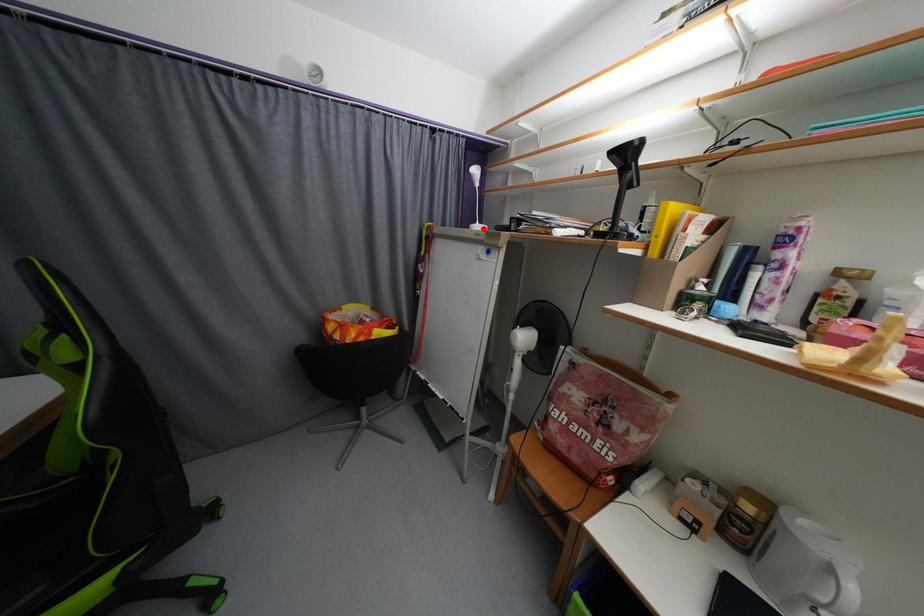
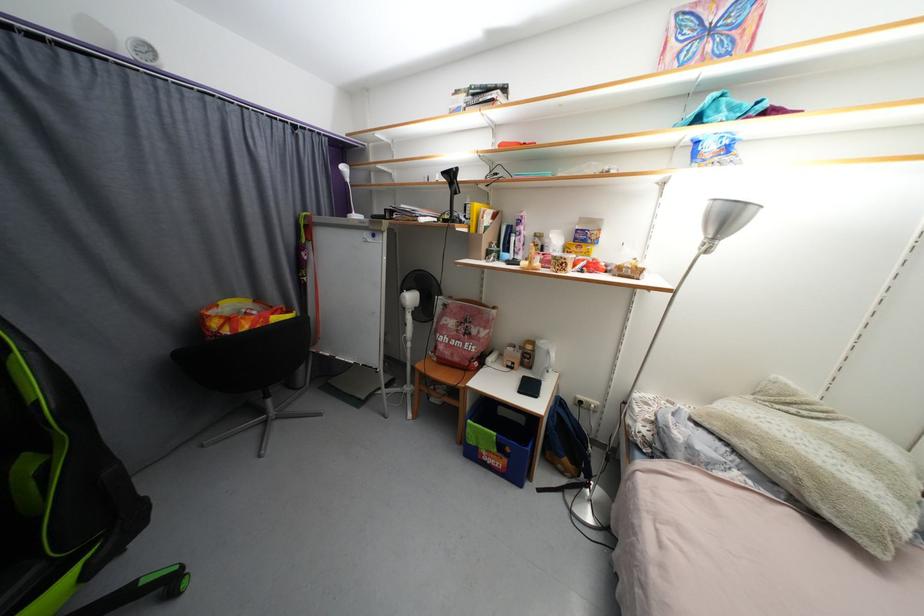
Where in the second image is the point corresponding to the highlighted location from the first image?

(360, 217)